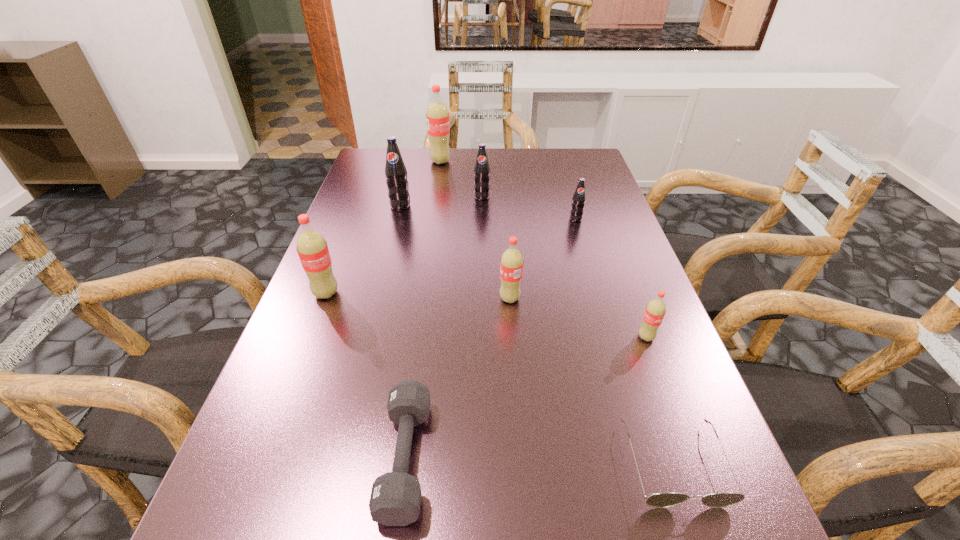
Locate an element on the screen. This screenshot has height=540, width=960. the farthest object is located at coordinates (437, 116).

Image resolution: width=960 pixels, height=540 pixels. I want to click on the farthest red soda, so click(x=437, y=116).

The width and height of the screenshot is (960, 540). Identify the location of the sixth soda from right to left. (395, 171).

Find the location of `the leftmost black pop`. the leftmost black pop is located at coordinates (395, 171).

This screenshot has height=540, width=960. What are the coordinates of `the leftmost soda` in the screenshot? It's located at (311, 246).

The height and width of the screenshot is (540, 960). What are the coordinates of `the leftmost object` in the screenshot? It's located at (311, 246).

You are a GUI agent. You are given a task and a screenshot of the screen. Output one action in this format:
    pyautogui.click(x=<x>, y=<y>)
    Task: Click on the fourth soda from left to right
    
    Given the screenshot: What is the action you would take?
    (481, 169)

Identify the location of the second smallest black pop. (481, 169).

This screenshot has height=540, width=960. I want to click on the fourth object from right to left, so click(511, 264).

Locate an element on the screen. Image resolution: width=960 pixels, height=540 pixels. the third red soda from left to right is located at coordinates (511, 264).